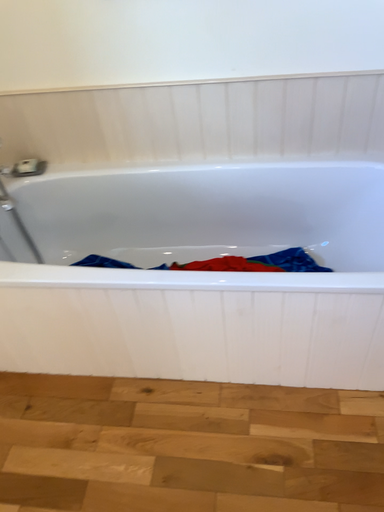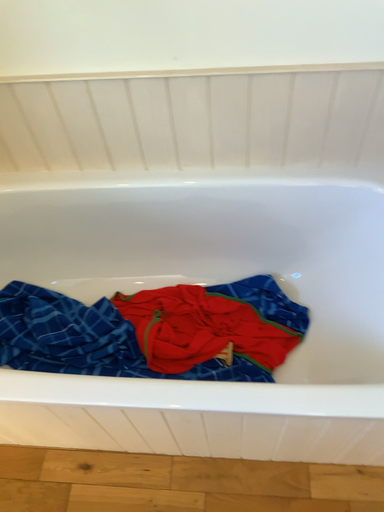
Question: Which way did the camera rotate in the video?

Choices:
 (A) rotated upward
 (B) rotated downward

Answer: (B)